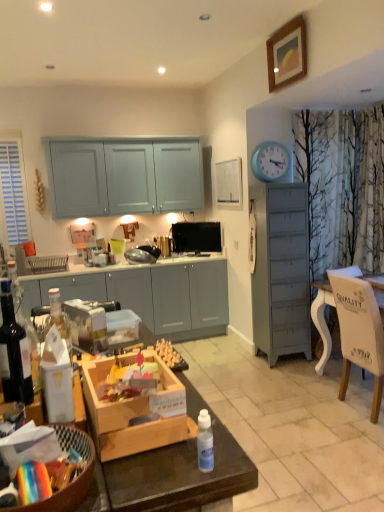
Question: Considering the relative sizes of silver metallic toaster at center and wooden toy box at center in the image provided, is silver metallic toaster at center thinner than wooden toy box at center?

Choices:
 (A) no
 (B) yes

Answer: (B)

Question: Can you confirm if silver metallic toaster at center is taller than wooden toy box at center?

Choices:
 (A) yes
 (B) no

Answer: (A)

Question: From the image's perspective, would you say silver metallic toaster at center is shown under wooden toy box at center?

Choices:
 (A) no
 (B) yes

Answer: (A)

Question: Is silver metallic toaster at center oriented away from wooden toy box at center?

Choices:
 (A) no
 (B) yes

Answer: (B)

Question: Is silver metallic toaster at center oriented towards wooden toy box at center?

Choices:
 (A) yes
 (B) no

Answer: (B)

Question: Considering the relative sizes of silver metallic toaster at center and wooden toy box at center in the image provided, is silver metallic toaster at center smaller than wooden toy box at center?

Choices:
 (A) yes
 (B) no

Answer: (A)

Question: From the image's perspective, is white wood chair at right on wooden toy box at center?

Choices:
 (A) yes
 (B) no

Answer: (B)

Question: Does white wood chair at right have a lesser width compared to wooden toy box at center?

Choices:
 (A) yes
 (B) no

Answer: (B)

Question: Is white wood chair at right completely or partially outside of wooden toy box at center?

Choices:
 (A) yes
 (B) no

Answer: (A)

Question: From a real-world perspective, does white wood chair at right stand above wooden toy box at center?

Choices:
 (A) yes
 (B) no

Answer: (B)

Question: Is white wood chair at right oriented towards wooden toy box at center?

Choices:
 (A) no
 (B) yes

Answer: (A)

Question: Is the position of white wood chair at right less distant than that of wooden toy box at center?

Choices:
 (A) yes
 (B) no

Answer: (B)

Question: Is black glossy television at upper center next to satin black toaster at center?

Choices:
 (A) yes
 (B) no

Answer: (B)